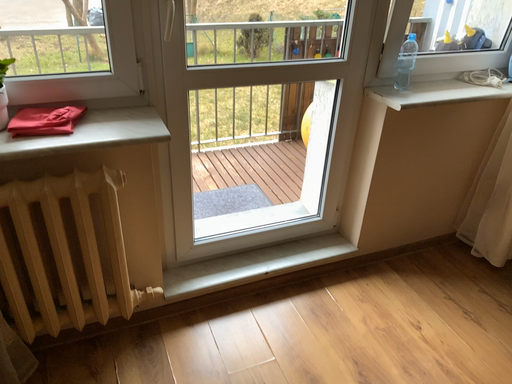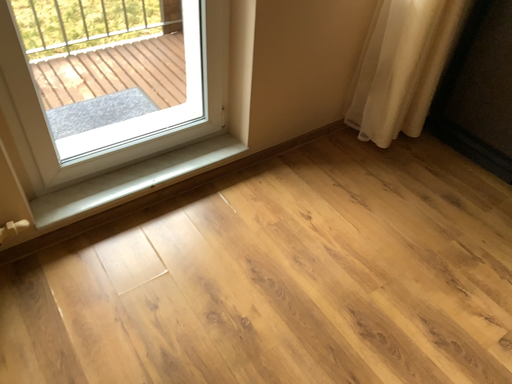
Question: Which way did the camera rotate in the video?

Choices:
 (A) rotated downward
 (B) rotated upward

Answer: (A)